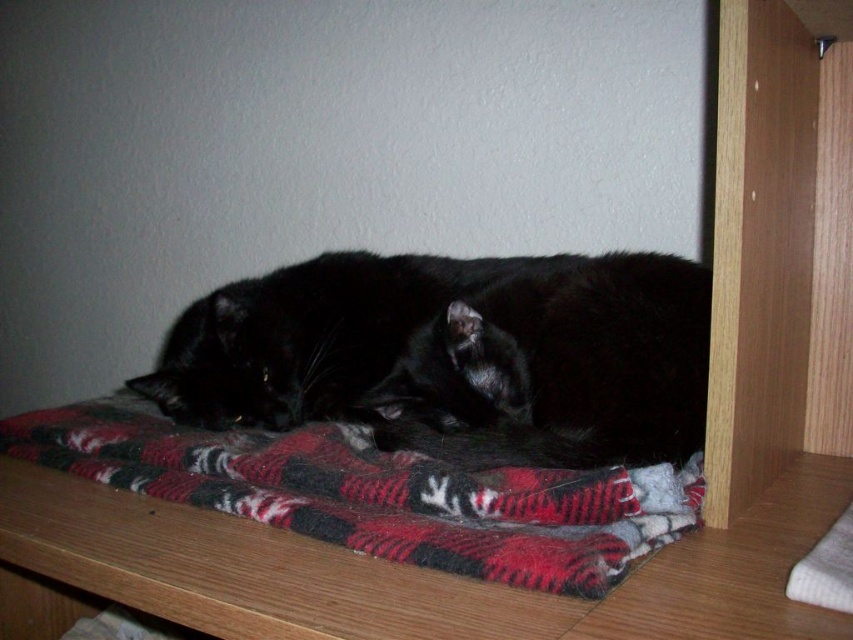
Question: Does black fuzzy cat at center lie behind red plaid blanket at center?

Choices:
 (A) no
 (B) yes

Answer: (B)

Question: Can you confirm if black fuzzy cat at center is positioned below red plaid blanket at center?

Choices:
 (A) no
 (B) yes

Answer: (A)

Question: Which point is closer to the camera?

Choices:
 (A) black fuzzy cat at center
 (B) red plaid blanket at center

Answer: (B)

Question: Which point is farther to the camera?

Choices:
 (A) red plaid blanket at center
 (B) black fuzzy cat at center

Answer: (B)

Question: Does black fuzzy cat at center lie in front of red plaid blanket at center?

Choices:
 (A) yes
 (B) no

Answer: (B)

Question: Which object is farther from the camera taking this photo?

Choices:
 (A) red plaid blanket at center
 (B) black fuzzy cat at center

Answer: (B)